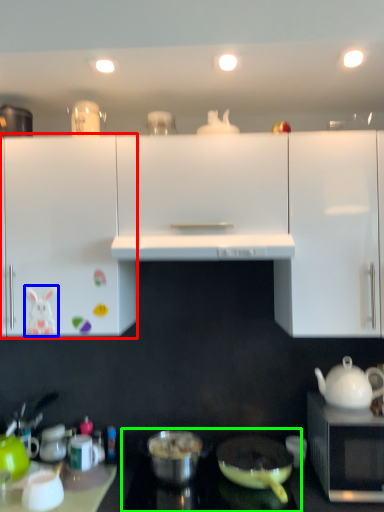
Question: Estimate the real-world distances between objects in this image. Which object is closer to cabinetry (highlighted by a red box), animal (highlighted by a blue box) or gas stove (highlighted by a green box)?

Choices:
 (A) animal
 (B) gas stove

Answer: (A)